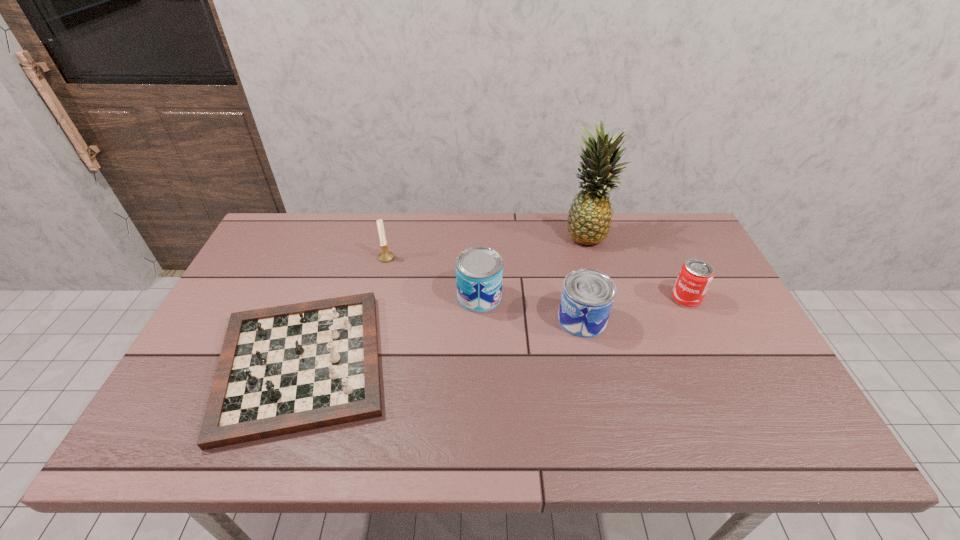
Where is `vacant area that satisfies the following two spatial constraints: 1. on the back side of the shortest object; 2. on the left side of the third object from left to right`? The height and width of the screenshot is (540, 960). vacant area that satisfies the following two spatial constraints: 1. on the back side of the shortest object; 2. on the left side of the third object from left to right is located at coordinates (325, 296).

Find the location of `free space that satisfies the following two spatial constraints: 1. on the front side of the tallest object; 2. on the front label of the second can from left to right`. free space that satisfies the following two spatial constraints: 1. on the front side of the tallest object; 2. on the front label of the second can from left to right is located at coordinates (612, 320).